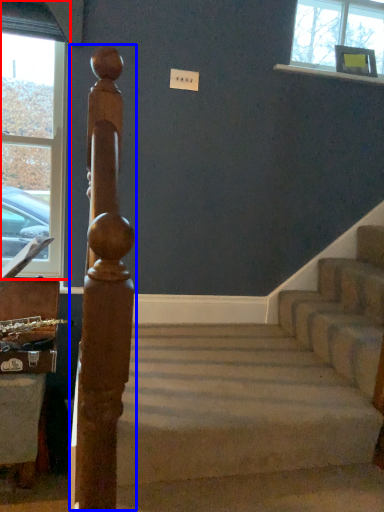
Question: Which point is further to the camera, window (highlighted by a red box) or beam (highlighted by a blue box)?

Choices:
 (A) window
 (B) beam

Answer: (A)